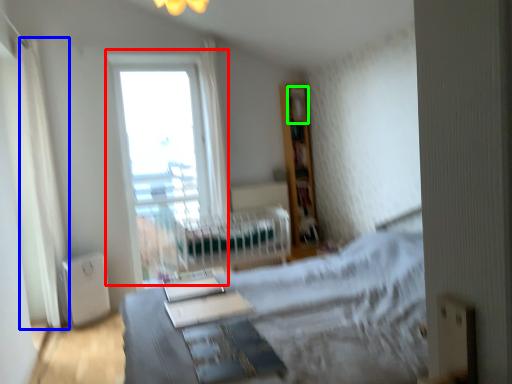
Question: Estimate the real-world distances between objects in this image. Which object is farther from window (highlighted by a red box), curtain (highlighted by a blue box) or shelf (highlighted by a green box)?

Choices:
 (A) curtain
 (B) shelf

Answer: (B)